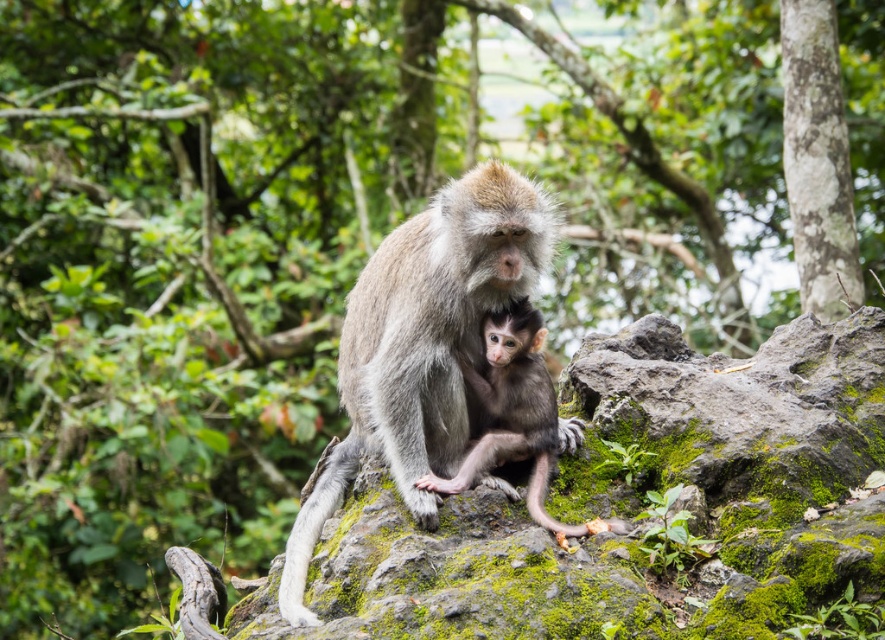
You are a hiker who wants to sit on the green mossy rock at center. However, you notice the gray fur monkey at center is already sitting there. Based on their sizes, do you think the monkey can comfortably move aside to make space for you?

The gray fur monkey at center is taller than the green mossy rock at center. Since the monkey is taller, it might be difficult for it to move aside comfortably to make space for you.

You are a hiker who has spotted a mossy rock in the forest. You want to place a small backpack on the green mossy rock at center. Can you confirm if the rock is located at the coordinates point (633, 502)?

Yes, the green mossy rock at center is located at point (633, 502), so you can place your backpack there.